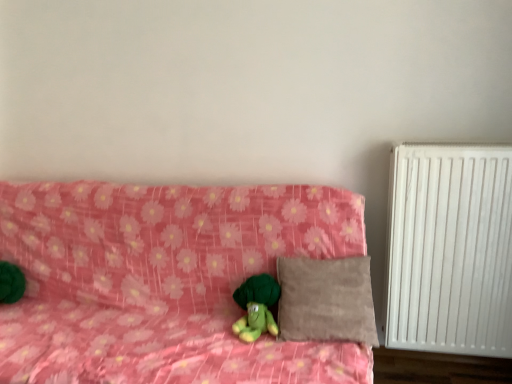
Question: Is pink floral fabric couch at center taller than white matte radiator at right?

Choices:
 (A) yes
 (B) no

Answer: (B)

Question: Is white matte radiator at right a part of pink floral fabric couch at center?

Choices:
 (A) no
 (B) yes

Answer: (A)

Question: From the image's perspective, is pink floral fabric couch at center on top of white matte radiator at right?

Choices:
 (A) no
 (B) yes

Answer: (A)

Question: Can we say pink floral fabric couch at center lies outside white matte radiator at right?

Choices:
 (A) yes
 (B) no

Answer: (A)

Question: Does pink floral fabric couch at center appear on the right side of white matte radiator at right?

Choices:
 (A) yes
 (B) no

Answer: (B)

Question: From the image's perspective, would you say pink floral fabric couch at center is shown under white matte radiator at right?

Choices:
 (A) no
 (B) yes

Answer: (B)

Question: Is beige suede pillow at center not close to green plush toy at center?

Choices:
 (A) yes
 (B) no

Answer: (B)

Question: Is beige suede pillow at center oriented away from green plush toy at center?

Choices:
 (A) yes
 (B) no

Answer: (B)

Question: Is beige suede pillow at center located outside green plush toy at center?

Choices:
 (A) no
 (B) yes

Answer: (B)

Question: From the image's perspective, is beige suede pillow at center located above green plush toy at center?

Choices:
 (A) no
 (B) yes

Answer: (B)

Question: Is beige suede pillow at center further to camera compared to green plush toy at center?

Choices:
 (A) yes
 (B) no

Answer: (B)

Question: Is beige suede pillow at center smaller than green plush toy at center?

Choices:
 (A) yes
 (B) no

Answer: (B)

Question: From a real-world perspective, is pink floral fabric couch at center below green plush toy at center?

Choices:
 (A) yes
 (B) no

Answer: (A)